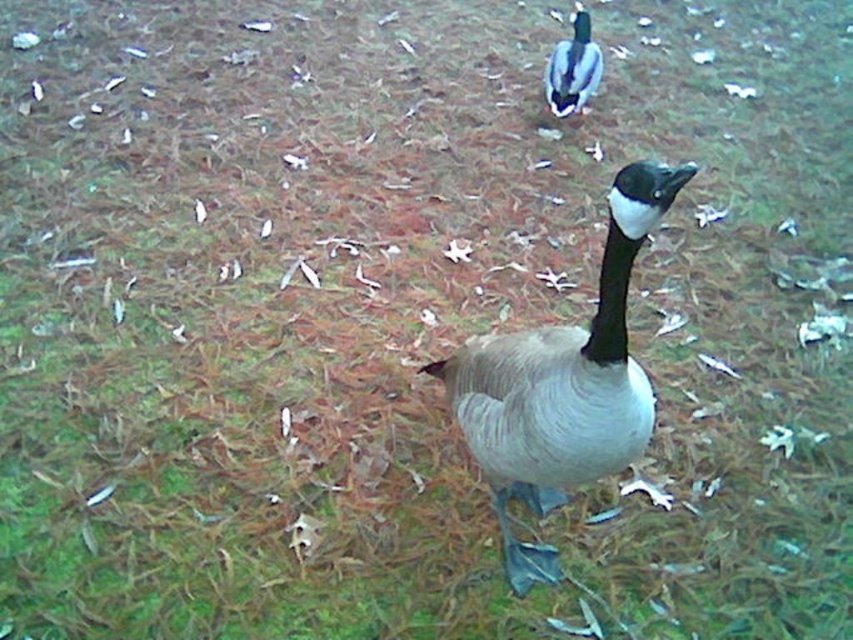
Does gray matte goose at center have a greater height compared to green glossy duck at upper center?

Correct, gray matte goose at center is much taller as green glossy duck at upper center.

Is gray matte goose at center wider than green glossy duck at upper center?

Indeed, gray matte goose at center has a greater width compared to green glossy duck at upper center.

Who is more distant from viewer, (689,172) or (544,77)?

Positioned behind is point (544,77).

The image size is (853, 640). In order to click on gray matte goose at center in this screenshot , I will do `click(561, 385)`.